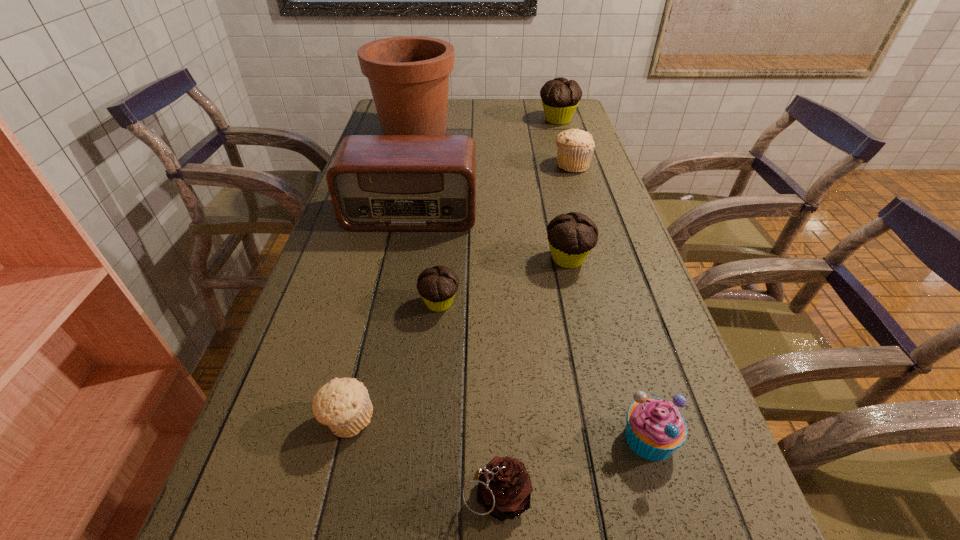
Locate an element on the screen. The width and height of the screenshot is (960, 540). free space between the fifth muffin from right to left and the tallest muffin is located at coordinates (498, 212).

Where is `vacant point located between the blue muffin and the second nearest chocolate muffin`? vacant point located between the blue muffin and the second nearest chocolate muffin is located at coordinates (609, 348).

Locate an element on the screen. vacant area between the second biggest chocolate muffin and the smaller beige muffin is located at coordinates (458, 339).

You are a GUI agent. You are given a task and a screenshot of the screen. Output one action in this format:
    pyautogui.click(x=<x>, y=<y>)
    Task: Click on the free point between the farthest muffin and the pinecone
    The height and width of the screenshot is (540, 960).
    Given the screenshot: What is the action you would take?
    pyautogui.click(x=527, y=307)

Locate which object ranks sixth in proximity to the blue muffin. Please provide its 2D coordinates. Your answer should be formatted as a tuple, i.e. [(x, y)], where the tuple contains the x and y coordinates of a point satisfying the conditions above.

[(575, 147)]

Point out which object is positioned as the sixth nearest to the blue muffin. Please provide its 2D coordinates. Your answer should be formatted as a tuple, i.e. [(x, y)], where the tuple contains the x and y coordinates of a point satisfying the conditions above.

[(575, 147)]

This screenshot has width=960, height=540. I want to click on muffin identified as the closest to the radio receiver, so click(571, 236).

At what (x,y) coordinates should I click in order to perform the action: click on the second closest muffin to the seventh shortest object. Please return your answer as a coordinate pair (x, y). The width and height of the screenshot is (960, 540). Looking at the image, I should click on (571, 236).

Select which chocolate muffin appears as the third closest to the nearer beige muffin. Please provide its 2D coordinates. Your answer should be formatted as a tuple, i.e. [(x, y)], where the tuple contains the x and y coordinates of a point satisfying the conditions above.

[(560, 97)]

At what (x,y) coordinates should I click in order to perform the action: click on chocolate muffin that is the second nearest to the blue muffin. Please return your answer as a coordinate pair (x, y). The width and height of the screenshot is (960, 540). Looking at the image, I should click on (437, 286).